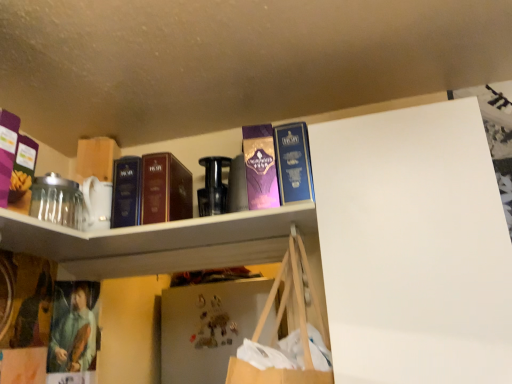
Question: Is white glossy shelf at upper center to the right of purple glossy paperback book at upper center from the viewer's perspective?

Choices:
 (A) yes
 (B) no

Answer: (B)

Question: Is white glossy shelf at upper center not within purple glossy paperback book at upper center?

Choices:
 (A) no
 (B) yes

Answer: (B)

Question: Considering the relative positions of white glossy shelf at upper center and purple glossy paperback book at upper center in the image provided, is white glossy shelf at upper center behind purple glossy paperback book at upper center?

Choices:
 (A) yes
 (B) no

Answer: (B)

Question: Is purple glossy paperback book at upper center located within white glossy shelf at upper center?

Choices:
 (A) no
 (B) yes

Answer: (A)

Question: Considering the relative sizes of white glossy shelf at upper center and purple glossy paperback book at upper center in the image provided, is white glossy shelf at upper center taller than purple glossy paperback book at upper center?

Choices:
 (A) no
 (B) yes

Answer: (A)

Question: From the image's perspective, is dark blue hardcover book at center, the first book from the left, located above or below metallic gold magnet at center?

Choices:
 (A) below
 (B) above

Answer: (B)

Question: From their relative heights in the image, would you say dark blue hardcover book at center, marked as the third book in a right-to-left arrangement, is taller or shorter than metallic gold magnet at center?

Choices:
 (A) short
 (B) tall

Answer: (B)

Question: Is dark blue hardcover book at center, marked as the third book in a right-to-left arrangement, bigger or smaller than metallic gold magnet at center?

Choices:
 (A) big
 (B) small

Answer: (A)

Question: Is dark blue hardcover book at center, the first book from the left, inside the boundaries of metallic gold magnet at center, or outside?

Choices:
 (A) inside
 (B) outside

Answer: (B)

Question: Considering the positions of metallic gold magnet at center and metallic black bottle at center in the image, is metallic gold magnet at center wider or thinner than metallic black bottle at center?

Choices:
 (A) thin
 (B) wide

Answer: (A)

Question: From the image's perspective, is metallic gold magnet at center located above or below metallic black bottle at center?

Choices:
 (A) below
 (B) above

Answer: (A)

Question: In the image, is metallic gold magnet at center positioned in front of or behind metallic black bottle at center?

Choices:
 (A) behind
 (B) front

Answer: (A)

Question: Is metallic gold magnet at center spatially inside metallic black bottle at center, or outside of it?

Choices:
 (A) outside
 (B) inside

Answer: (A)

Question: Looking at the image, does matte brown book at upper center, which is the 2th book from left to right, seem bigger or smaller compared to dark blue hardcover book at center, the first book from the left?

Choices:
 (A) small
 (B) big

Answer: (A)

Question: Looking at their shapes, would you say matte brown book at upper center, which is the 2th book from left to right, is wider or thinner than dark blue hardcover book at center, the first book from the left?

Choices:
 (A) thin
 (B) wide

Answer: (A)